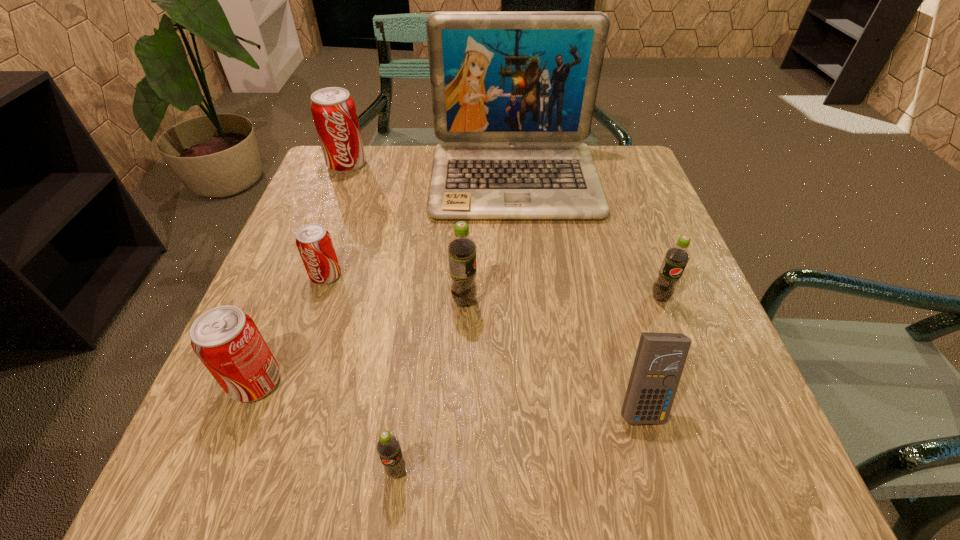
Where is `laptop computer that is at the far edge`? The width and height of the screenshot is (960, 540). laptop computer that is at the far edge is located at coordinates click(x=513, y=93).

Image resolution: width=960 pixels, height=540 pixels. I want to click on soda can that is at the far edge, so pos(333,110).

Locate an element on the screen. This screenshot has width=960, height=540. object that is at the near edge is located at coordinates (388, 448).

I want to click on laptop computer positioned at the right edge, so coord(513,93).

Image resolution: width=960 pixels, height=540 pixels. Find the location of `soda that is at the right edge`. soda that is at the right edge is located at coordinates (676, 258).

Where is `calculator that is at the right edge`? The width and height of the screenshot is (960, 540). calculator that is at the right edge is located at coordinates (660, 358).

The image size is (960, 540). I want to click on object present at the far left corner, so click(333, 110).

You are a GUI agent. You are given a task and a screenshot of the screen. Output one action in this format:
    pyautogui.click(x=<x>, y=<y>)
    Task: Click on the object at the far right corner
    
    Given the screenshot: What is the action you would take?
    pyautogui.click(x=513, y=93)

This screenshot has width=960, height=540. Identify the location of free point at the far edge. (420, 151).

In the image, there is a desktop. Identify the location of free space at the near edge. (294, 467).